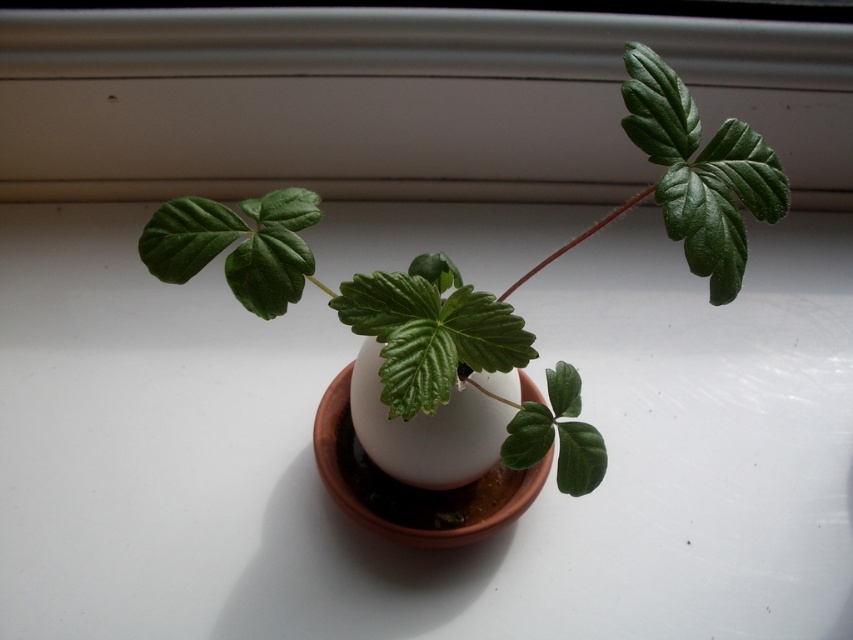
The width and height of the screenshot is (853, 640). I want to click on white matte window sill at upper center, so click(x=393, y=100).

Is white matte window sill at upper center closer to the viewer compared to green matte plant at center?

No, it is not.

Between point (544, 118) and point (213, 225), which one is positioned in front?

Positioned in front is point (213, 225).

Find the location of a particular element. white matte window sill at upper center is located at coordinates (393, 100).

Is white matte window sill at upper center positioned before terracotta clay pot at center?

No.

Between white matte window sill at upper center and terracotta clay pot at center, which one is positioned lower?

terracotta clay pot at center is below.

Find the location of a particular element. This screenshot has width=853, height=640. white matte window sill at upper center is located at coordinates (393, 100).

Identify the location of white matte window sill at upper center. (393, 100).

Is green matte plant at center smaller than terracotta clay pot at center?

No.

Between green matte plant at center and terracotta clay pot at center, which one is positioned higher?

Positioned higher is green matte plant at center.

From the picture: Who is more forward, (686, 205) or (459, 504)?

Point (686, 205) is in front.

Locate an element on the screen. The width and height of the screenshot is (853, 640). green matte plant at center is located at coordinates (483, 291).